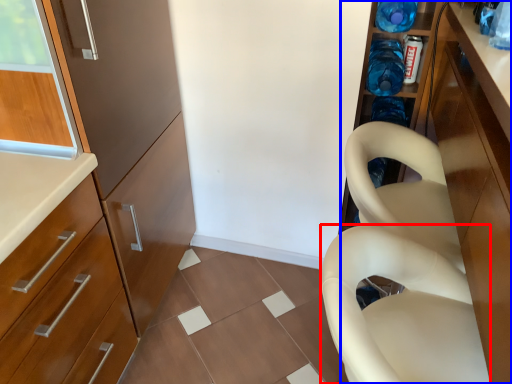
Question: Which object is closer to the camera taking this photo, feeding chair (highlighted by a red box) or cabinetry (highlighted by a blue box)?

Choices:
 (A) feeding chair
 (B) cabinetry

Answer: (B)